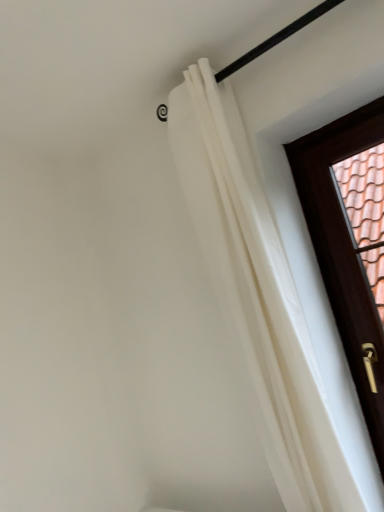
Question: Is white sheer curtain at upper right taller or shorter than brown wooden door at right?

Choices:
 (A) tall
 (B) short

Answer: (A)

Question: Relative to brown wooden door at right, is white sheer curtain at upper right in front or behind?

Choices:
 (A) front
 (B) behind

Answer: (A)

Question: From the image's perspective, is white sheer curtain at upper right located above or below brown wooden door at right?

Choices:
 (A) above
 (B) below

Answer: (A)

Question: Based on their sizes in the image, would you say brown wooden door at right is bigger or smaller than white sheer curtain at upper right?

Choices:
 (A) big
 (B) small

Answer: (B)

Question: Is brown wooden door at right in front of or behind white sheer curtain at upper right in the image?

Choices:
 (A) behind
 (B) front

Answer: (A)

Question: Considering the positions of brown wooden door at right and white sheer curtain at upper right in the image, is brown wooden door at right wider or thinner than white sheer curtain at upper right?

Choices:
 (A) thin
 (B) wide

Answer: (A)

Question: From their relative heights in the image, would you say brown wooden door at right is taller or shorter than white sheer curtain at upper right?

Choices:
 (A) short
 (B) tall

Answer: (A)